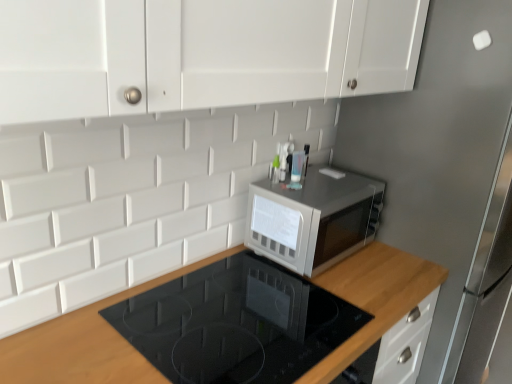
Question: Is wooden at upper right positioned in front of satin silver microwave at center?

Choices:
 (A) no
 (B) yes

Answer: (B)

Question: Can you confirm if wooden at upper right is bigger than satin silver microwave at center?

Choices:
 (A) no
 (B) yes

Answer: (B)

Question: Considering the relative sizes of wooden at upper right and satin silver microwave at center in the image provided, is wooden at upper right smaller than satin silver microwave at center?

Choices:
 (A) yes
 (B) no

Answer: (B)

Question: Is wooden at upper right outside of satin silver microwave at center?

Choices:
 (A) no
 (B) yes

Answer: (B)

Question: From a real-world perspective, is wooden at upper right positioned over satin silver microwave at center based on gravity?

Choices:
 (A) yes
 (B) no

Answer: (B)

Question: Considering the relative positions of satin silver microwave at center and satin silver fridge at upper right in the image provided, is satin silver microwave at center to the left or to the right of satin silver fridge at upper right?

Choices:
 (A) right
 (B) left

Answer: (B)

Question: Is satin silver microwave at center in front of or behind satin silver fridge at upper right in the image?

Choices:
 (A) behind
 (B) front

Answer: (A)

Question: Do you think satin silver microwave at center is within satin silver fridge at upper right, or outside of it?

Choices:
 (A) outside
 (B) inside

Answer: (A)

Question: Looking at the image, does satin silver microwave at center seem bigger or smaller compared to satin silver fridge at upper right?

Choices:
 (A) small
 (B) big

Answer: (A)

Question: Is point (184, 266) closer or farther from the camera than point (446, 337)?

Choices:
 (A) farther
 (B) closer

Answer: (B)

Question: From the image's perspective, is wooden at upper right positioned above or below satin silver fridge at upper right?

Choices:
 (A) below
 (B) above

Answer: (A)

Question: Considering the positions of wooden at upper right and satin silver fridge at upper right in the image, is wooden at upper right wider or thinner than satin silver fridge at upper right?

Choices:
 (A) thin
 (B) wide

Answer: (A)

Question: Considering the positions of wooden at upper right and satin silver fridge at upper right in the image, is wooden at upper right taller or shorter than satin silver fridge at upper right?

Choices:
 (A) tall
 (B) short

Answer: (B)

Question: Considering the positions of point (329, 264) and point (40, 379), is point (329, 264) closer or farther from the camera than point (40, 379)?

Choices:
 (A) closer
 (B) farther

Answer: (B)

Question: From a real-world perspective, is satin silver microwave at center positioned above or below wooden at upper right?

Choices:
 (A) below
 (B) above

Answer: (B)